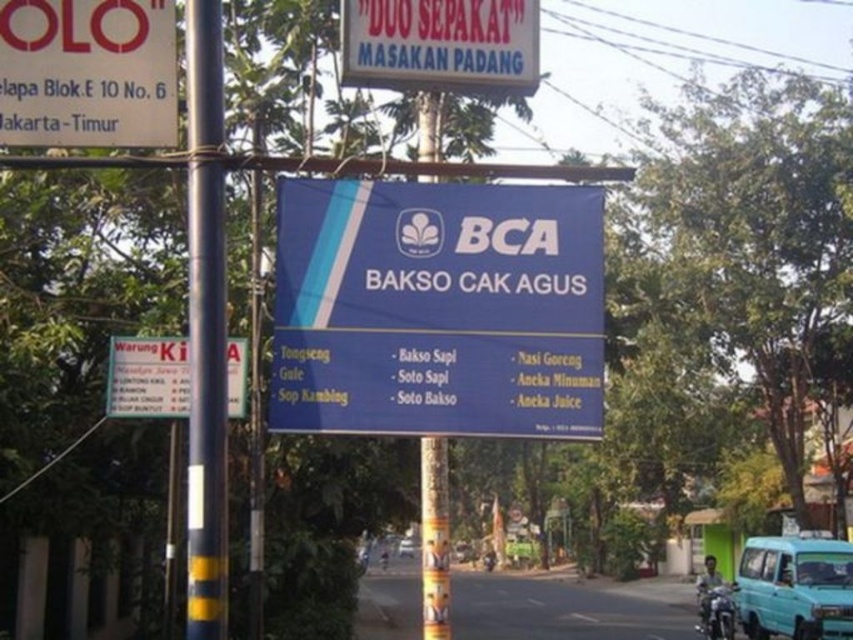
Which of these two, white plastic signboard at upper center or blue metallic van at center, stands taller?

Standing taller between the two is blue metallic van at center.

Between point (531, 19) and point (409, 545), which one is positioned behind?

Point (409, 545)

In the scene shown: Who is more forward, [453,4] or [402,540]?

Point [453,4] is more forward.

The image size is (853, 640). Find the location of `white plastic signboard at upper center`. white plastic signboard at upper center is located at coordinates (440, 44).

Which is more to the left, blue painted metal pole at left or white paper sign at left?

Positioned to the left is white paper sign at left.

Does blue painted metal pole at left come behind white paper sign at left?

No, blue painted metal pole at left is closer to the viewer.

Who is more distant from viewer, (212, 620) or (149, 356)?

The point (149, 356) is behind.

Where is `blue painted metal pole at left`? blue painted metal pole at left is located at coordinates (206, 326).

How much distance is there between blue painted metal pole at left and teal matte van at lower right?

They are 57.90 feet apart.

Which of these two, blue painted metal pole at left or teal matte van at lower right, stands shorter?

teal matte van at lower right is shorter.

Is point (193, 385) positioned before point (846, 588)?

Yes, it is.

Where is `blue painted metal pole at left`? blue painted metal pole at left is located at coordinates (206, 326).